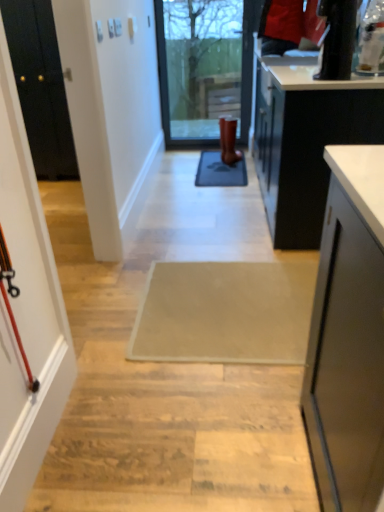
How much space does gray rubber doormat at center, marked as the second doormat in a bottom-to-top arrangement, occupy vertically?

The height of gray rubber doormat at center, marked as the second doormat in a bottom-to-top arrangement, is 1.57 inches.

Image resolution: width=384 pixels, height=512 pixels. What do you see at coordinates (228, 140) in the screenshot?
I see `brown leather boot at center` at bounding box center [228, 140].

This screenshot has height=512, width=384. What do you see at coordinates (204, 75) in the screenshot?
I see `transparent glass door at center` at bounding box center [204, 75].

Locate an element on the screen. The width and height of the screenshot is (384, 512). gray rubber doormat at center, placed as the first doormat when sorted from top to bottom is located at coordinates (220, 170).

Considering the sizes of objects transparent glass door at center and matte black screen door at left in the image provided, who is smaller, transparent glass door at center or matte black screen door at left?

Smaller between the two is matte black screen door at left.

Between transparent glass door at center and matte black screen door at left, which one is positioned behind?

transparent glass door at center is further away from the camera.

In the scene shown: From the image's perspective, is transparent glass door at center located beneath matte black screen door at left?

No, from the image's perspective, transparent glass door at center is not below matte black screen door at left.

Would you say white glossy countertop at upper right contains beige fabric doormat at center, which is the 1th doormat from bottom to top?

No, beige fabric doormat at center, which is the 1th doormat from bottom to top, is not surrounded by white glossy countertop at upper right.

Is there a large distance between white glossy countertop at upper right and beige fabric doormat at center, which is the second doormat from back to front?

Yes, white glossy countertop at upper right is far from beige fabric doormat at center, which is the second doormat from back to front.

Is white glossy countertop at upper right facing towards beige fabric doormat at center, marked as the second doormat in a top-to-bottom arrangement?

No, white glossy countertop at upper right does not turn towards beige fabric doormat at center, marked as the second doormat in a top-to-bottom arrangement.

Considering the relative positions of matte black screen door at left and gray rubber doormat at center, marked as the second doormat in a bottom-to-top arrangement, in the image provided, is matte black screen door at left to the right of gray rubber doormat at center, marked as the second doormat in a bottom-to-top arrangement, from the viewer's perspective?

Incorrect, matte black screen door at left is not on the right side of gray rubber doormat at center, marked as the second doormat in a bottom-to-top arrangement.

Who is shorter, matte black screen door at left or gray rubber doormat at center, which is the first doormat from back to front?

gray rubber doormat at center, which is the first doormat from back to front, is shorter.

Looking at this image, from the image's perspective, which one is positioned higher, matte black screen door at left or gray rubber doormat at center, marked as the second doormat in a bottom-to-top arrangement?

gray rubber doormat at center, marked as the second doormat in a bottom-to-top arrangement.

Considering the sizes of matte black screen door at left and gray rubber doormat at center, which is the first doormat from back to front, in the image, is matte black screen door at left wider or thinner than gray rubber doormat at center, which is the first doormat from back to front,?

Considering their sizes, matte black screen door at left looks slimmer than gray rubber doormat at center, which is the first doormat from back to front.

Which is in front, point (186, 314) or point (2, 462)?

The point (2, 462) is closer to the camera.

From the image's perspective, which object appears higher, beige fabric doormat at center, which is the 1th doormat from bottom to top, or matte black screen door at left?

From the image's view, matte black screen door at left is above.

Considering the relative positions of beige fabric doormat at center, marked as the second doormat in a top-to-bottom arrangement, and matte black screen door at left in the image provided, is beige fabric doormat at center, marked as the second doormat in a top-to-bottom arrangement, to the right of matte black screen door at left from the viewer's perspective?

Yes, beige fabric doormat at center, marked as the second doormat in a top-to-bottom arrangement, is to the right of matte black screen door at left.

Does beige fabric doormat at center, which is the second doormat from back to front, turn towards matte black screen door at left?

No.

Is matte black screen door at left far away from beige fabric doormat at center, marked as the second doormat in a top-to-bottom arrangement?

That's not correct — matte black screen door at left is a little close to beige fabric doormat at center, marked as the second doormat in a top-to-bottom arrangement.

Which object is wider, matte black screen door at left or beige fabric doormat at center, marked as the second doormat in a top-to-bottom arrangement?

With larger width is beige fabric doormat at center, marked as the second doormat in a top-to-bottom arrangement.

Is matte black screen door at left situated inside beige fabric doormat at center, which is the 1th doormat from bottom to top, or outside?

matte black screen door at left exists outside the volume of beige fabric doormat at center, which is the 1th doormat from bottom to top.

How distant is matte black screen door at left from beige fabric doormat at center, which is the 1th doormat from bottom to top?

68.68 centimeters.

Does beige fabric doormat at center, marked as the second doormat in a top-to-bottom arrangement, have a lesser height compared to white glossy countertop at upper right?

Correct, beige fabric doormat at center, marked as the second doormat in a top-to-bottom arrangement, is not as tall as white glossy countertop at upper right.

Is beige fabric doormat at center, marked as the second doormat in a top-to-bottom arrangement, looking in the opposite direction of white glossy countertop at upper right?

No.

Does point (270, 322) appear closer or farther from the camera than point (353, 79)?

Point (270, 322) appears to be closer to the viewer than point (353, 79).

Is the surface of beige fabric doormat at center, which is the 1th doormat from bottom to top, in direct contact with white glossy countertop at upper right?

No.

This screenshot has width=384, height=512. Identify the location of glass door on the left of white glossy countertop at upper right. (204, 75).

From the picture: Considering the relative positions of transparent glass door at center and white glossy countertop at upper right in the image provided, is transparent glass door at center behind white glossy countertop at upper right?

Yes.

Which of these two, transparent glass door at center or white glossy countertop at upper right, is bigger?

Bigger between the two is transparent glass door at center.

Would you say transparent glass door at center is a long distance from white glossy countertop at upper right?

transparent glass door at center is far away from white glossy countertop at upper right.

In the image, there is a matte black screen door at left. Where is `glass door above it (from the image's perspective)`? glass door above it (from the image's perspective) is located at coordinates (204, 75).

In order to click on counter top above the beige fabric doormat at center, marked as the second doormat in a top-to-bottom arrangement (from a real-world perspective) in this screenshot , I will do `click(310, 75)`.

Considering their positions, is gray rubber doormat at center, marked as the second doormat in a bottom-to-top arrangement, positioned further to beige fabric doormat at center, which is the second doormat from back to front, than white glossy countertop at upper right?

gray rubber doormat at center, marked as the second doormat in a bottom-to-top arrangement, lies further to beige fabric doormat at center, which is the second doormat from back to front, than the other object.

Based on the photo, when comparing their distances from gray rubber doormat at center, positioned as the second doormat in front-to-back order, does transparent glass door at center or brown leather boot at center seem closer?

brown leather boot at center is closer to gray rubber doormat at center, positioned as the second doormat in front-to-back order.

Considering their positions, is matte black screen door at left positioned closer to brown leather boot at center than beige fabric doormat at center, which appears as the 1th doormat when viewed from the front?

Based on the image, beige fabric doormat at center, which appears as the 1th doormat when viewed from the front, appears to be nearer to brown leather boot at center.

Based on their spatial positions, is transparent glass door at center or brown leather boot at center further from matte black screen door at left?

transparent glass door at center.

When comparing their distances from transparent glass door at center, does beige fabric doormat at center, which is the second doormat from back to front, or brown leather boot at center seem closer?

The object closer to transparent glass door at center is brown leather boot at center.

Which object lies nearer to the anchor point brown leather boot at center, white glossy countertop at upper right or matte black screen door at left?

Based on the image, white glossy countertop at upper right appears to be nearer to brown leather boot at center.

From the image, which object appears to be nearer to beige fabric doormat at center, which is the second doormat from back to front, gray rubber doormat at center, marked as the second doormat in a bottom-to-top arrangement, or transparent glass door at center?

gray rubber doormat at center, marked as the second doormat in a bottom-to-top arrangement.

Which object lies further to the anchor point gray rubber doormat at center, positioned as the second doormat in front-to-back order, transparent glass door at center or beige fabric doormat at center, which is the 1th doormat from bottom to top?

beige fabric doormat at center, which is the 1th doormat from bottom to top, is further to gray rubber doormat at center, positioned as the second doormat in front-to-back order.

Where is `footwear located between beige fabric doormat at center, which is the 1th doormat from bottom to top, and transparent glass door at center in the depth direction`? This screenshot has width=384, height=512. footwear located between beige fabric doormat at center, which is the 1th doormat from bottom to top, and transparent glass door at center in the depth direction is located at coordinates (228, 140).

Identify the location of counter top between beige fabric doormat at center, which appears as the 1th doormat when viewed from the front, and brown leather boot at center in the front-back direction. The width and height of the screenshot is (384, 512). (310, 75).

In order to click on doormat positioned between matte black screen door at left and gray rubber doormat at center, which is the first doormat from back to front, from near to far in this screenshot , I will do `click(225, 312)`.

Where is `counter top located between beige fabric doormat at center, marked as the second doormat in a top-to-bottom arrangement, and transparent glass door at center in the depth direction`? This screenshot has height=512, width=384. counter top located between beige fabric doormat at center, marked as the second doormat in a top-to-bottom arrangement, and transparent glass door at center in the depth direction is located at coordinates (310, 75).